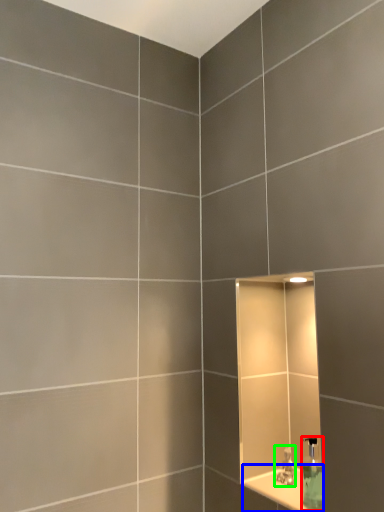
Question: Which object is positioned closest to soap dispenser (highlighted by a red box)? Select from ledge (highlighted by a blue box) and tap (highlighted by a green box).

Choices:
 (A) ledge
 (B) tap

Answer: (A)